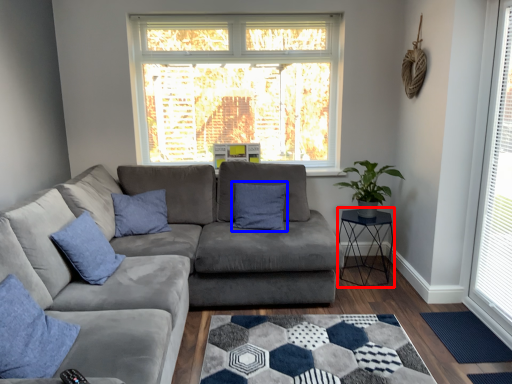
Question: Which of the following is the farthest to the observer, cocktail table (highlighted by a red box) or pillow (highlighted by a blue box)?

Choices:
 (A) cocktail table
 (B) pillow

Answer: (B)